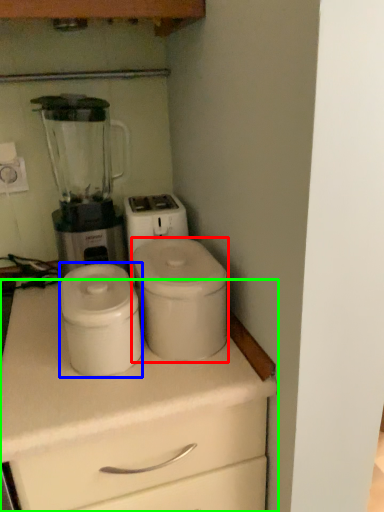
Question: Which is farther away from appliance (highlighted by a red box)? appliance (highlighted by a blue box) or chest of drawers (highlighted by a green box)?

Choices:
 (A) appliance
 (B) chest of drawers

Answer: (B)